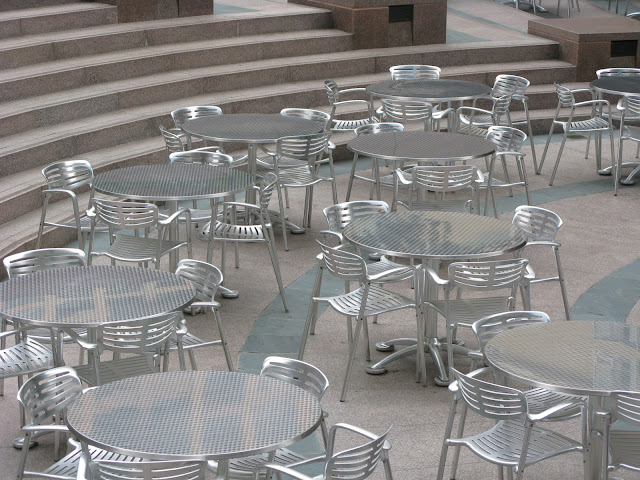
At what (x,y) coordinates should I click in order to perform the action: click on grey tile rings. Please return your answer as a coordinate pair (x, y). Image resolution: width=640 pixels, height=480 pixels. Looking at the image, I should click on (273, 321), (617, 283), (342, 166).